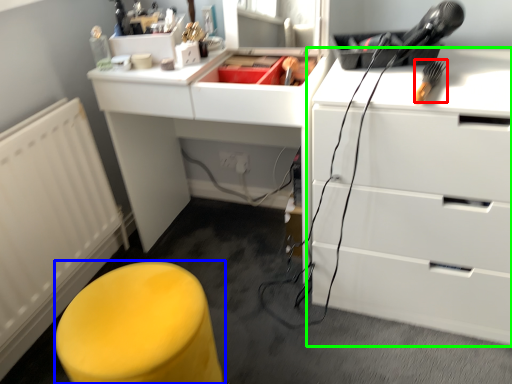
Question: Estimate the real-world distances between objects in this image. Which object is closer to tool (highlighted by a red box), furniture (highlighted by a blue box) or chest of drawers (highlighted by a green box)?

Choices:
 (A) furniture
 (B) chest of drawers

Answer: (B)